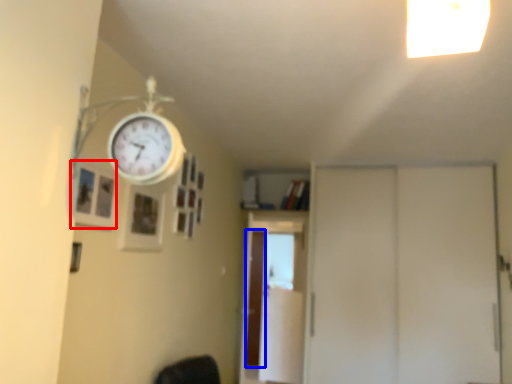
Question: Which point is closer to the camera, picture frame (highlighted by a red box) or screen door (highlighted by a blue box)?

Choices:
 (A) picture frame
 (B) screen door

Answer: (A)